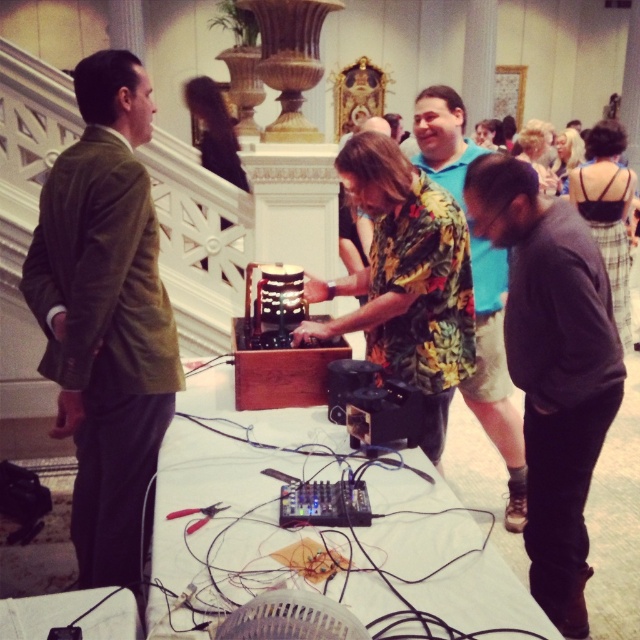
Question: In this image, where is black satin dress at center located relative to blonde hair at upper center?

Choices:
 (A) left
 (B) right

Answer: (A)

Question: Does black satin dress at center have a smaller size compared to blonde hair at upper center?

Choices:
 (A) no
 (B) yes

Answer: (B)

Question: Which point is closer to the camera?

Choices:
 (A) blonde hair at center
 (B) green velvet suit at left
 (C) floral shirt at center
 (D) dark gray sweater at lower right

Answer: (D)

Question: Which object is positioned farthest from the dark gray sweater at lower right?

Choices:
 (A) black plastic table at center
 (B) floral print shirt at center
 (C) black satin dress at center

Answer: (C)

Question: Which point is closer to the camera?

Choices:
 (A) floral shirt at center
 (B) blonde hair at center
 (C) green velvet suit at left

Answer: (C)

Question: Does green velvet suit at left appear over blonde hair at center?

Choices:
 (A) no
 (B) yes

Answer: (A)